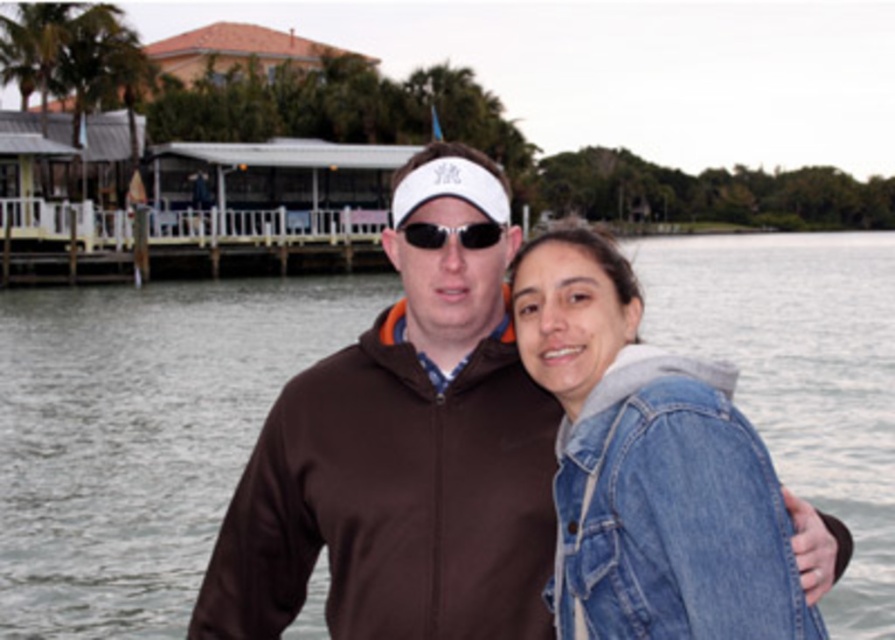
You are a photographer trying to capture a clear shot of the denim jacket at lower right and the black plastic sunglasses at center. Since you want to focus on the taller object, which one should you adjust your camera to focus on?

The denim jacket at lower right is taller than the black plastic sunglasses at center, so you should adjust your camera to focus on the denim jacket at lower right.